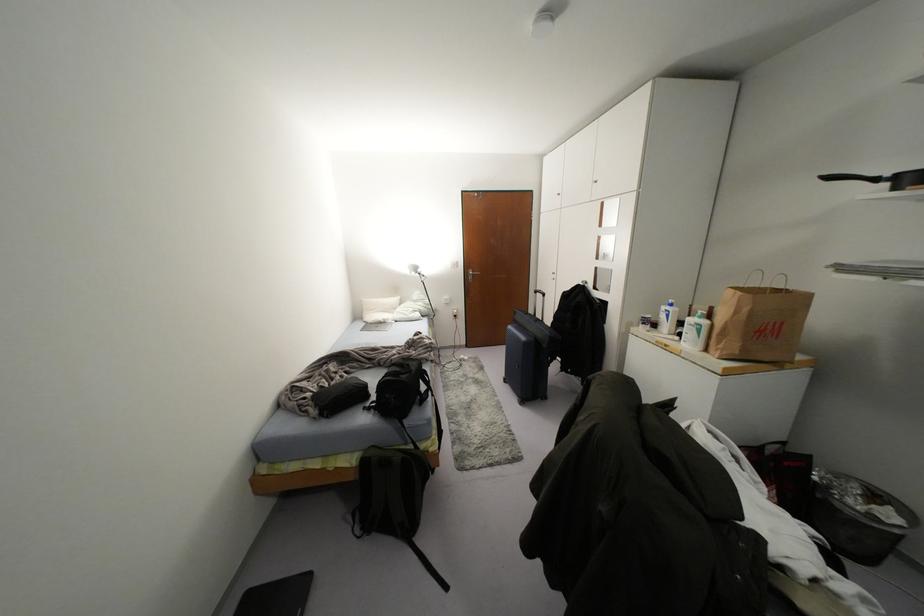
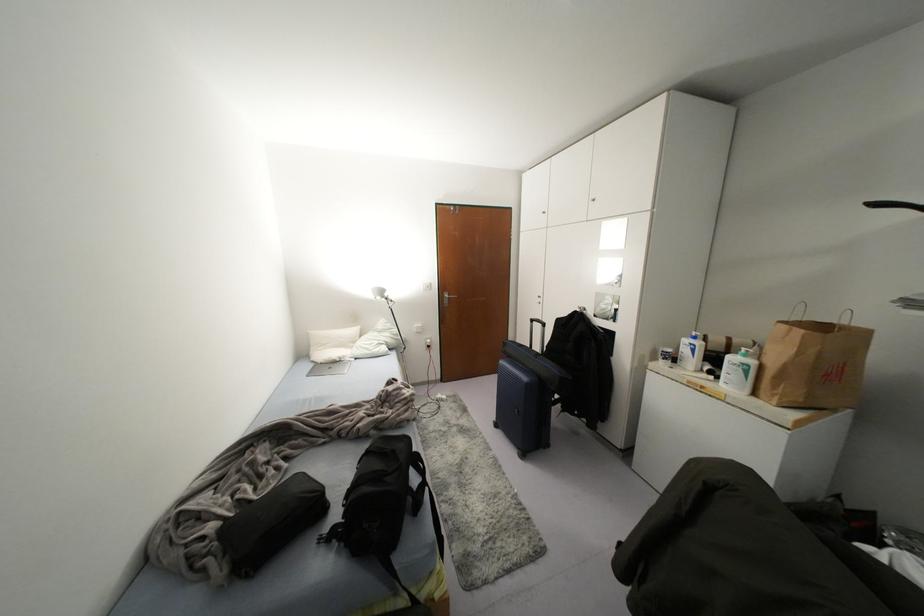
The point at (x=542, y=294) is marked in the first image. Where is the corresponding point in the second image?

(542, 323)